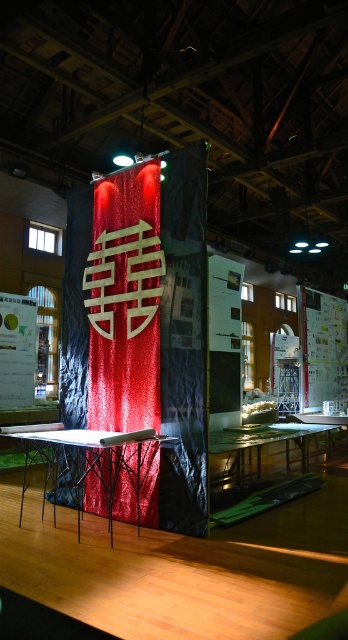
Is point (116, 449) positioned after point (246, 445)?

No, (116, 449) is in front of (246, 445).

Can you confirm if metallic silver table at center is wider than clear glass table at center?

No, metallic silver table at center is not wider than clear glass table at center.

Is point (112, 481) positioned before point (244, 474)?

Yes, it is.

Image resolution: width=348 pixels, height=640 pixels. Find the location of `metallic silver table at center`. metallic silver table at center is located at coordinates (96, 460).

Is point (103, 369) positioned behind point (307, 449)?

No, it is not.

Between shiny sequined curtain at center and clear glass table at center, which one is positioned lower?

clear glass table at center is lower down.

Describe the element at coordinates (124, 300) in the screenshot. I see `shiny sequined curtain at center` at that location.

This screenshot has height=640, width=348. Identify the location of shiny sequined curtain at center. (124, 300).

Can you confirm if shiny sequined curtain at center is positioned above metallic silver table at center?

Indeed, shiny sequined curtain at center is positioned over metallic silver table at center.

Does point (138, 397) come in front of point (21, 492)?

Yes, it is in front of point (21, 492).

Locate an element on the screen. This screenshot has width=348, height=640. shiny sequined curtain at center is located at coordinates (124, 300).